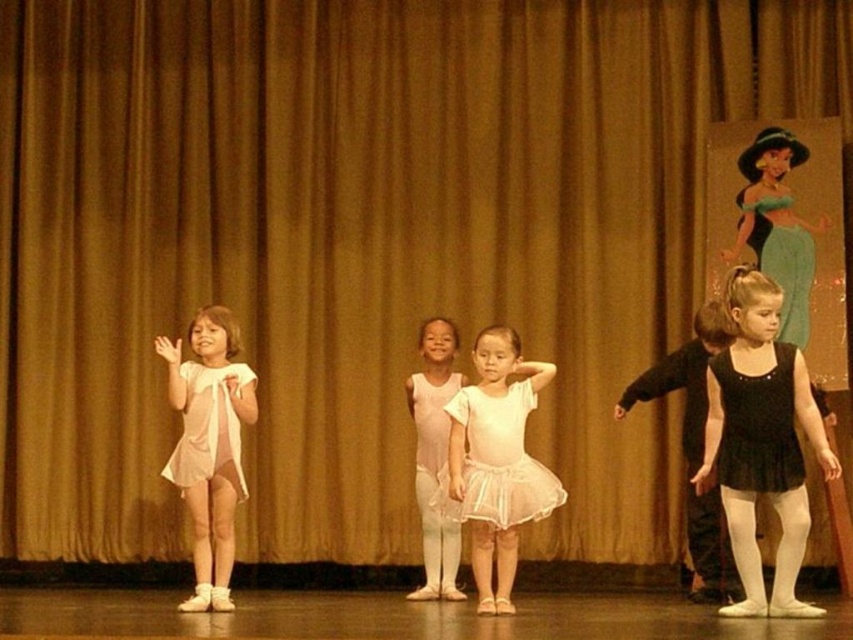
Can you confirm if black satin dress at lower right is positioned above pink satin tutu at center?

Yes, black satin dress at lower right is above pink satin tutu at center.

Does black satin dress at lower right appear on the right side of pink satin tutu at center?

Yes, black satin dress at lower right is to the right of pink satin tutu at center.

Find the location of a particular element. The height and width of the screenshot is (640, 853). black satin dress at lower right is located at coordinates (757, 426).

Who is shorter, white tulle skirt at center or black matte ballet dress at right?

white tulle skirt at center is shorter.

In the scene shown: Can you confirm if white tulle skirt at center is shorter than black matte ballet dress at right?

Yes.

Is point (525, 513) behind point (699, 358)?

No, (525, 513) is closer to viewer.

The width and height of the screenshot is (853, 640). I want to click on white tulle skirt at center, so pos(497,461).

Can you confirm if white tulle skirt at center is positioned below black satin dress at lower right?

Correct, white tulle skirt at center is located below black satin dress at lower right.

What do you see at coordinates (497, 461) in the screenshot?
I see `white tulle skirt at center` at bounding box center [497, 461].

Image resolution: width=853 pixels, height=640 pixels. I want to click on white tulle skirt at center, so click(497, 461).